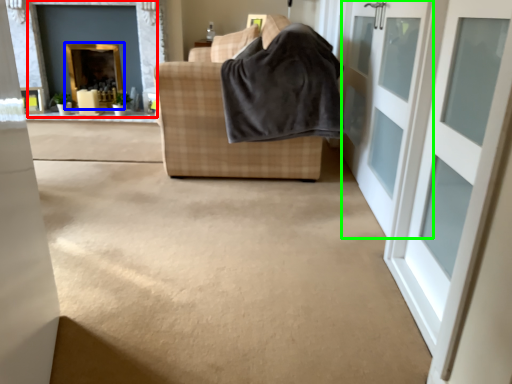
Question: Which object is the closest to the fireplace (highlighted by a red box)? Choose among these: fireplace (highlighted by a blue box) or door (highlighted by a green box).

Choices:
 (A) fireplace
 (B) door

Answer: (A)